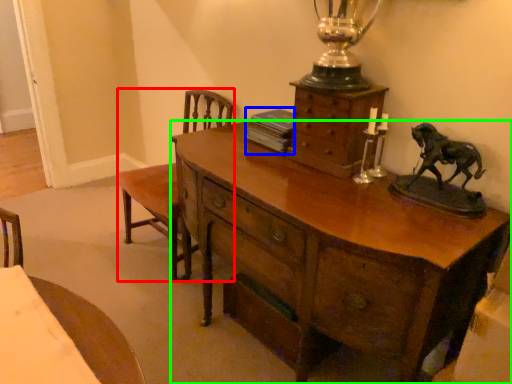
Question: Based on their relative distances, which object is nearer to armchair (highlighted by a red box)? Choose from book (highlighted by a blue box) and desk (highlighted by a green box).

Choices:
 (A) book
 (B) desk

Answer: (A)